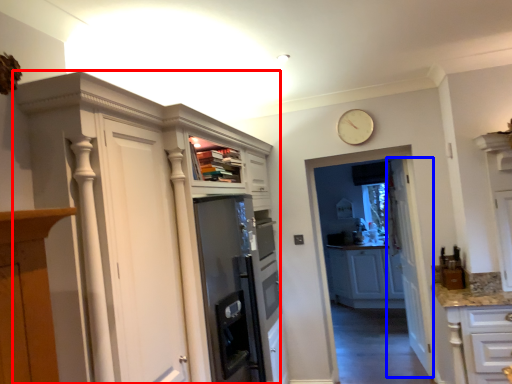
Question: Which object appears closest to the camera in this image, cupboard (highlighted by a red box) or door (highlighted by a blue box)?

Choices:
 (A) cupboard
 (B) door

Answer: (A)